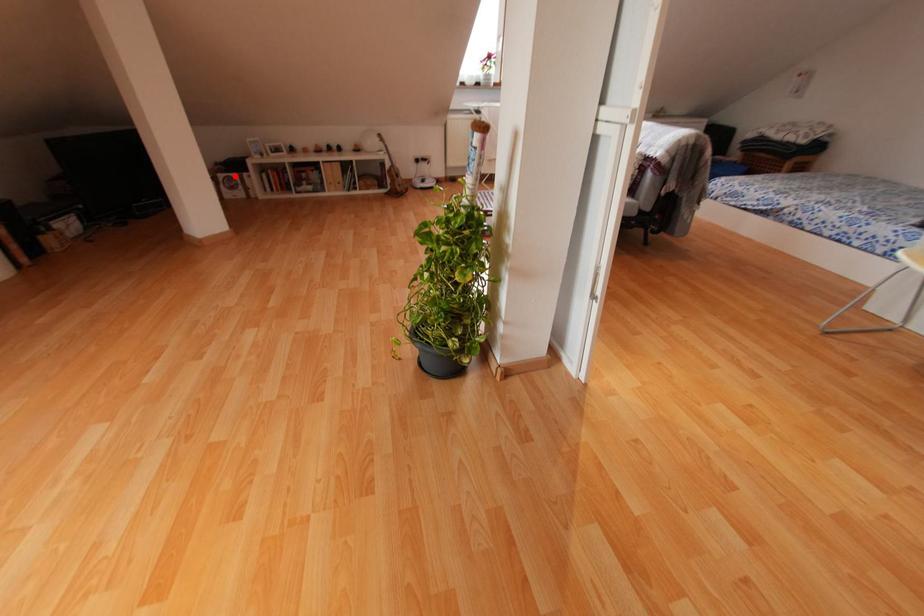
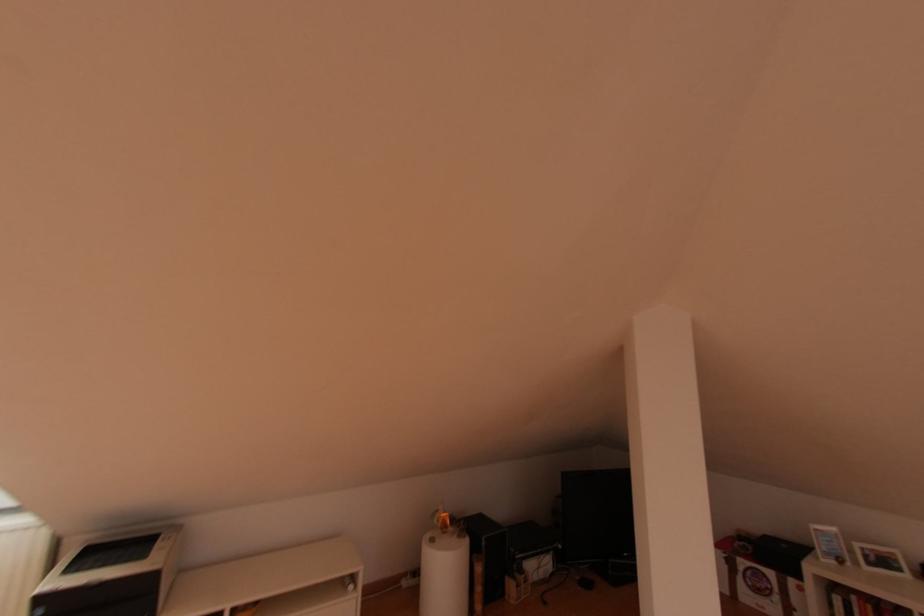
Where in the second image is the point corresponding to the highlighted location from the first image?

(771, 573)